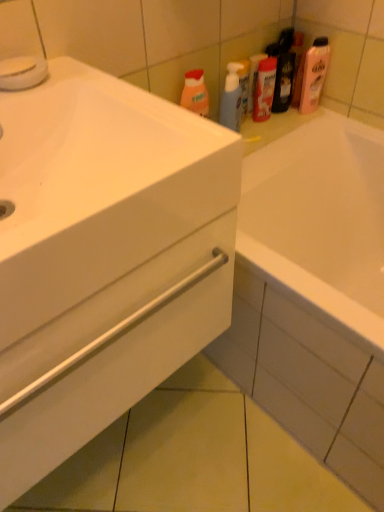
Based on the photo, measure the distance between point (262, 106) and camera.

Point (262, 106) and camera are 1.30 meters apart.

The image size is (384, 512). Find the location of `pink glossy lotion at upper right, the second cleaning product positioned from the left`. pink glossy lotion at upper right, the second cleaning product positioned from the left is located at coordinates (314, 74).

Identify the location of translucent plastic spray bottle at upper center, which is the first cleaning product from left to right. (231, 98).

Looking at the image, does pink glossy lotion at upper right, placed as the first cleaning product when sorted from right to left, seem bigger or smaller compared to matte plastic mouthwash at upper center?

pink glossy lotion at upper right, placed as the first cleaning product when sorted from right to left, is bigger than matte plastic mouthwash at upper center.

Does point (310, 64) appear closer or farther from the camera than point (253, 120)?

Point (310, 64) is positioned farther from the camera compared to point (253, 120).

Considering the positions of objects pink glossy lotion at upper right, the second cleaning product positioned from the left, and matte plastic mouthwash at upper center in the image provided, who is more to the left, pink glossy lotion at upper right, the second cleaning product positioned from the left, or matte plastic mouthwash at upper center?

Positioned to the left is matte plastic mouthwash at upper center.

Which object is positioned more to the left, translucent plastic spray bottle at upper center, which is the first cleaning product from left to right, or white glossy cabinet at lower left?

Positioned to the left is white glossy cabinet at lower left.

From a real-world perspective, which is physically above, translucent plastic spray bottle at upper center, which ranks as the 2th cleaning product in right-to-left order, or white glossy cabinet at lower left?

In real-world perspective, translucent plastic spray bottle at upper center, which ranks as the 2th cleaning product in right-to-left order, is above.

From the image's perspective, is translucent plastic spray bottle at upper center, which ranks as the 2th cleaning product in right-to-left order, above or below white glossy cabinet at lower left?

translucent plastic spray bottle at upper center, which ranks as the 2th cleaning product in right-to-left order, is above white glossy cabinet at lower left.

Does point (234, 64) come farther from viewer compared to point (199, 260)?

Yes, point (234, 64) is farther from viewer.

You are a GUI agent. You are given a task and a screenshot of the screen. Output one action in this format:
    pyautogui.click(x=<x>, y=<y>)
    Task: Click on the cleaning product below the matte plastic mouthwash at upper center (from the image's perspective)
    Image resolution: width=384 pixels, height=512 pixels.
    Given the screenshot: What is the action you would take?
    pyautogui.click(x=231, y=98)

Considering the relative positions of matte plastic mouthwash at upper center and translucent plastic spray bottle at upper center, which is the first cleaning product from left to right, in the image provided, is matte plastic mouthwash at upper center behind translucent plastic spray bottle at upper center, which is the first cleaning product from left to right,?

Yes, matte plastic mouthwash at upper center is further from the viewer.

Which of these two, matte plastic mouthwash at upper center or translucent plastic spray bottle at upper center, which ranks as the 2th cleaning product in right-to-left order, is bigger?

Bigger between the two is matte plastic mouthwash at upper center.

Looking at this image, from the image's perspective, between matte plastic mouthwash at upper center and translucent plastic spray bottle at upper center, which is the first cleaning product from left to right, who is located below?

translucent plastic spray bottle at upper center, which is the first cleaning product from left to right.

Which object is closer to the camera, white glossy cabinet at lower left or matte plastic mouthwash at upper center?

Positioned in front is white glossy cabinet at lower left.

Does white glossy cabinet at lower left touch matte plastic mouthwash at upper center?

No, white glossy cabinet at lower left is not making contact with matte plastic mouthwash at upper center.

Between white glossy cabinet at lower left and matte plastic mouthwash at upper center, which one has smaller size?

matte plastic mouthwash at upper center.

From the image's perspective, which one is positioned higher, white glossy cabinet at lower left or matte plastic mouthwash at upper center?

From the image's view, matte plastic mouthwash at upper center is above.

Is point (269, 88) farther from camera compared to point (0, 113)?

Yes, point (269, 88) is behind point (0, 113).

Would you say matte plastic mouthwash at upper center is outside white glossy cabinet at lower left?

Yes, matte plastic mouthwash at upper center is outside of white glossy cabinet at lower left.

The image size is (384, 512). I want to click on bathroom cabinet lying below the matte plastic mouthwash at upper center (from the image's perspective), so click(x=103, y=257).

From the image's perspective, between matte plastic mouthwash at upper center and white glossy cabinet at lower left, which one is located above?

matte plastic mouthwash at upper center, from the image's perspective.

From the image's perspective, which is below, translucent plastic spray bottle at upper center, which ranks as the 2th cleaning product in right-to-left order, or matte plastic mouthwash at upper center?

translucent plastic spray bottle at upper center, which ranks as the 2th cleaning product in right-to-left order, from the image's perspective.

From a real-world perspective, is translucent plastic spray bottle at upper center, which ranks as the 2th cleaning product in right-to-left order, positioned under matte plastic mouthwash at upper center based on gravity?

Yes, from a real-world perspective, translucent plastic spray bottle at upper center, which ranks as the 2th cleaning product in right-to-left order, is beneath matte plastic mouthwash at upper center.

Does translucent plastic spray bottle at upper center, which ranks as the 2th cleaning product in right-to-left order, contain matte plastic mouthwash at upper center?

No.

Looking at this image, between translucent plastic spray bottle at upper center, which ranks as the 2th cleaning product in right-to-left order, and matte plastic mouthwash at upper center, which one has larger size?

With larger size is matte plastic mouthwash at upper center.

Do you think white glossy cabinet at lower left is within translucent plastic spray bottle at upper center, which ranks as the 2th cleaning product in right-to-left order, or outside of it?

white glossy cabinet at lower left is spatially situated outside translucent plastic spray bottle at upper center, which ranks as the 2th cleaning product in right-to-left order.

From the picture: Considering the relative sizes of white glossy cabinet at lower left and translucent plastic spray bottle at upper center, which is the first cleaning product from left to right, in the image provided, is white glossy cabinet at lower left thinner than translucent plastic spray bottle at upper center, which is the first cleaning product from left to right,?

No.

From a real-world perspective, who is located higher, white glossy cabinet at lower left or translucent plastic spray bottle at upper center, which ranks as the 2th cleaning product in right-to-left order?

In real-world perspective, translucent plastic spray bottle at upper center, which ranks as the 2th cleaning product in right-to-left order, is above.

Considering the positions of objects white glossy cabinet at lower left and translucent plastic spray bottle at upper center, which ranks as the 2th cleaning product in right-to-left order, in the image provided, who is behind, white glossy cabinet at lower left or translucent plastic spray bottle at upper center, which ranks as the 2th cleaning product in right-to-left order,?

Positioned behind is translucent plastic spray bottle at upper center, which ranks as the 2th cleaning product in right-to-left order.

Locate an element on the screen. The width and height of the screenshot is (384, 512). cleaning product on the right side of matte plastic mouthwash at upper center is located at coordinates (314, 74).

Locate an element on the screen. bathroom cabinet on the left of the translucent plastic spray bottle at upper center, which ranks as the 2th cleaning product in right-to-left order is located at coordinates (103, 257).

Considering their positions, is white glossy cabinet at lower left positioned closer to translucent plastic spray bottle at upper center, which ranks as the 2th cleaning product in right-to-left order, than pink glossy lotion at upper right, the second cleaning product positioned from the left?

pink glossy lotion at upper right, the second cleaning product positioned from the left.

From the image, which object appears to be nearer to pink glossy lotion at upper right, placed as the first cleaning product when sorted from right to left, white glossy cabinet at lower left or translucent plastic spray bottle at upper center, which is the first cleaning product from left to right?

translucent plastic spray bottle at upper center, which is the first cleaning product from left to right.

When comparing their distances from pink glossy lotion at upper right, the second cleaning product positioned from the left, does white glossy cabinet at lower left or matte plastic mouthwash at upper center seem closer?

Among the two, matte plastic mouthwash at upper center is located nearer to pink glossy lotion at upper right, the second cleaning product positioned from the left.

Which object lies nearer to the anchor point translucent plastic spray bottle at upper center, which ranks as the 2th cleaning product in right-to-left order, matte plastic mouthwash at upper center or pink glossy lotion at upper right, the second cleaning product positioned from the left?

matte plastic mouthwash at upper center is positioned closer to the anchor translucent plastic spray bottle at upper center, which ranks as the 2th cleaning product in right-to-left order.

When comparing their distances from translucent plastic spray bottle at upper center, which is the first cleaning product from left to right, does pink glossy lotion at upper right, placed as the first cleaning product when sorted from right to left, or white glossy cabinet at lower left seem closer?

pink glossy lotion at upper right, placed as the first cleaning product when sorted from right to left, lies closer to translucent plastic spray bottle at upper center, which is the first cleaning product from left to right, than the other object.

Which object lies further to the anchor point matte plastic mouthwash at upper center, white glossy cabinet at lower left or translucent plastic spray bottle at upper center, which ranks as the 2th cleaning product in right-to-left order?

white glossy cabinet at lower left is further to matte plastic mouthwash at upper center.

When comparing their distances from matte plastic mouthwash at upper center, does pink glossy lotion at upper right, placed as the first cleaning product when sorted from right to left, or translucent plastic spray bottle at upper center, which ranks as the 2th cleaning product in right-to-left order, seem further?

Among the two, pink glossy lotion at upper right, placed as the first cleaning product when sorted from right to left, is located further to matte plastic mouthwash at upper center.

Consider the image. Estimate the real-world distances between objects in this image. Which object is closer to matte plastic mouthwash at upper center, white glossy cabinet at lower left or pink glossy lotion at upper right, placed as the first cleaning product when sorted from right to left?

pink glossy lotion at upper right, placed as the first cleaning product when sorted from right to left, is positioned closer to the anchor matte plastic mouthwash at upper center.

Identify the location of cleaning product between white glossy cabinet at lower left and translucent plastic spray bottle at upper center, which ranks as the 2th cleaning product in right-to-left order, in the front-back direction. The width and height of the screenshot is (384, 512). (314, 74).

Locate an element on the screen. The image size is (384, 512). mouthwash between translucent plastic spray bottle at upper center, which ranks as the 2th cleaning product in right-to-left order, and pink glossy lotion at upper right, placed as the first cleaning product when sorted from right to left, from left to right is located at coordinates (264, 89).